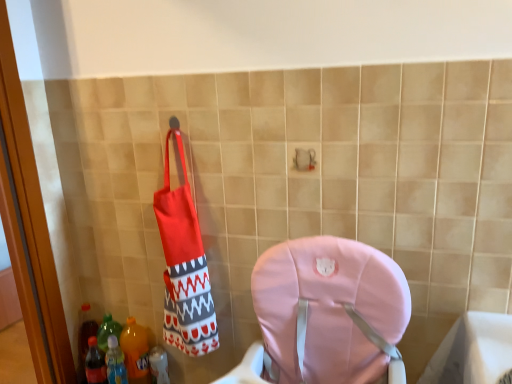
Question: Considering the positions of translucent plastic bottle at lower left, which is the second bottle in left-to-right order, and translucent plastic bottle at lower left, which is the 3th bottle from left to right, in the image, is translucent plastic bottle at lower left, which is the second bottle in left-to-right order, wider or thinner than translucent plastic bottle at lower left, which is the 3th bottle from left to right,?

Choices:
 (A) wide
 (B) thin

Answer: (A)

Question: Is translucent plastic bottle at lower left, which is the second bottle in left-to-right order, spatially inside translucent plastic bottle at lower left, which is the 3th bottle from left to right, or outside of it?

Choices:
 (A) inside
 (B) outside

Answer: (B)

Question: Which object is the farthest from the translucent plastic bottle at lower left, the 1th bottle from the right?

Choices:
 (A) translucent plastic bottle at lower left, which is the second bottle in left-to-right order
 (B) translucent plastic bottle at lower left, which is counted as the third bottle, starting from the right

Answer: (B)

Question: Estimate the real-world distances between objects in this image. Which object is farther from the translucent plastic bottle at lower left, the first bottle positioned from the left?

Choices:
 (A) translucent plastic bottle at lower left, the 1th bottle from the right
 (B) translucent plastic bottle at lower left, acting as the 2th bottle starting from the right

Answer: (A)